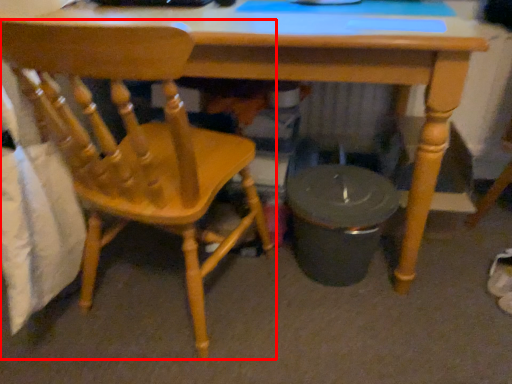
Question: From the image's perspective, where is chair (annotated by the red box) located in relation to desk in the image?

Choices:
 (A) above
 (B) below

Answer: (B)